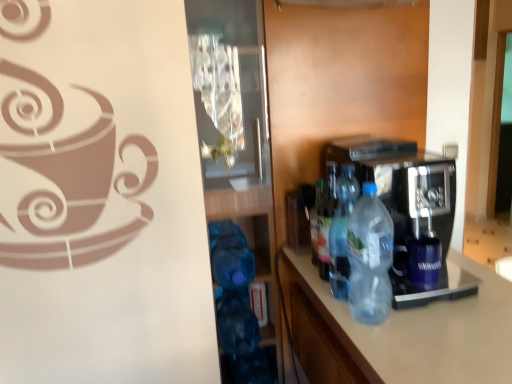
Question: Considering the relative positions of transparent glass door at center and translucent plastic bottle at center, which is the 3th bottle from back to front, in the image provided, is transparent glass door at center to the right of translucent plastic bottle at center, which is the 3th bottle from back to front, from the viewer's perspective?

Choices:
 (A) yes
 (B) no

Answer: (B)

Question: Can you confirm if transparent glass door at center is taller than translucent plastic bottle at center, which is the 3th bottle from back to front?

Choices:
 (A) no
 (B) yes

Answer: (B)

Question: Does transparent glass door at center have a larger size compared to translucent plastic bottle at center, positioned as the 1th bottle in front-to-back order?

Choices:
 (A) yes
 (B) no

Answer: (A)

Question: Can you confirm if transparent glass door at center is shorter than translucent plastic bottle at center, which is the 3th bottle from back to front?

Choices:
 (A) no
 (B) yes

Answer: (A)

Question: Does transparent glass door at center have a lesser width compared to translucent plastic bottle at center, which is the 3th bottle from back to front?

Choices:
 (A) no
 (B) yes

Answer: (A)

Question: From a real-world perspective, does transparent glass door at center sit lower than translucent plastic bottle at center, which is the 3th bottle from back to front?

Choices:
 (A) no
 (B) yes

Answer: (B)

Question: Is transparent glass door at center closer to the viewer compared to translucent plastic bottle at center, placed as the first bottle when sorted from back to front?

Choices:
 (A) yes
 (B) no

Answer: (A)

Question: From the image's perspective, is transparent glass door at center under translucent plastic bottle at center, placed as the first bottle when sorted from back to front?

Choices:
 (A) yes
 (B) no

Answer: (A)

Question: Is transparent glass door at center outside of translucent plastic bottle at center, placed as the first bottle when sorted from back to front?

Choices:
 (A) no
 (B) yes

Answer: (B)

Question: Is transparent glass door at center behind translucent plastic bottle at center, placed as the first bottle when sorted from back to front?

Choices:
 (A) yes
 (B) no

Answer: (B)

Question: Is transparent glass door at center thinner than translucent plastic bottle at center, the third bottle positioned from the front?

Choices:
 (A) yes
 (B) no

Answer: (B)

Question: Could you tell me if transparent glass door at center is facing translucent plastic bottle at center, placed as the first bottle when sorted from back to front?

Choices:
 (A) no
 (B) yes

Answer: (A)

Question: Does translucent plastic bottle at center, the third bottle positioned from the front, have a greater height compared to translucent plastic bottle at center, which is the 3th bottle from back to front?

Choices:
 (A) yes
 (B) no

Answer: (B)